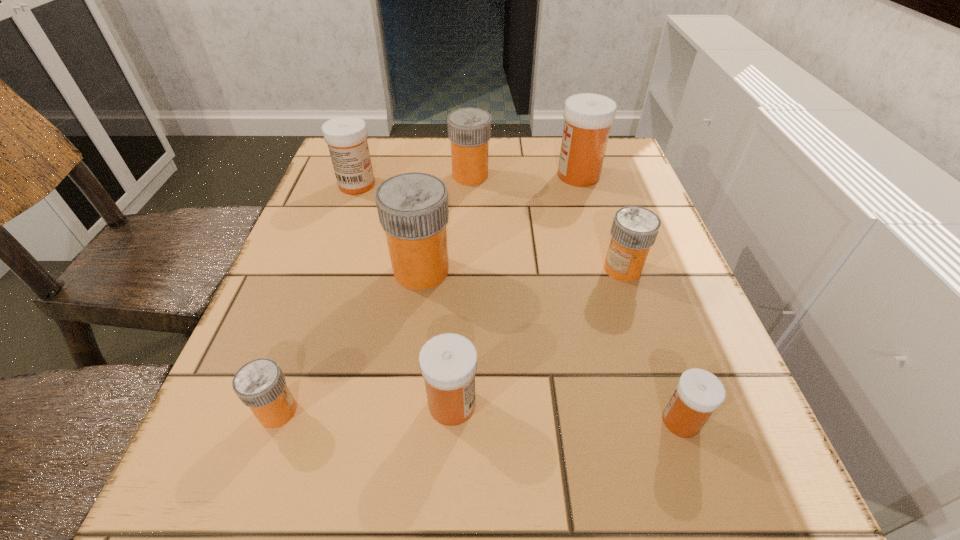
The image size is (960, 540). What are the coordinates of `the biggest white medicine` in the screenshot? It's located at (x=588, y=117).

In order to click on the biggest orange medicine in this screenshot , I will do `click(413, 211)`.

Image resolution: width=960 pixels, height=540 pixels. Find the location of `the leftmost white medicine`. the leftmost white medicine is located at coordinates (346, 136).

What are the coordinates of `the farthest orange medicine` in the screenshot? It's located at (469, 129).

I want to click on the rightmost orange medicine, so click(634, 229).

Where is `the second smallest white medicine`? This screenshot has height=540, width=960. the second smallest white medicine is located at coordinates (448, 362).

At what (x,y) coordinates should I click in order to perform the action: click on the smallest white medicine. Please return your answer as a coordinate pair (x, y). Image resolution: width=960 pixels, height=540 pixels. Looking at the image, I should click on (699, 393).

I want to click on the smallest orange medicine, so click(260, 384).

Locate an element on the screen. the leftmost orange medicine is located at coordinates (260, 384).

Where is `free location located on the left of the biggest white medicine`? The height and width of the screenshot is (540, 960). free location located on the left of the biggest white medicine is located at coordinates (401, 175).